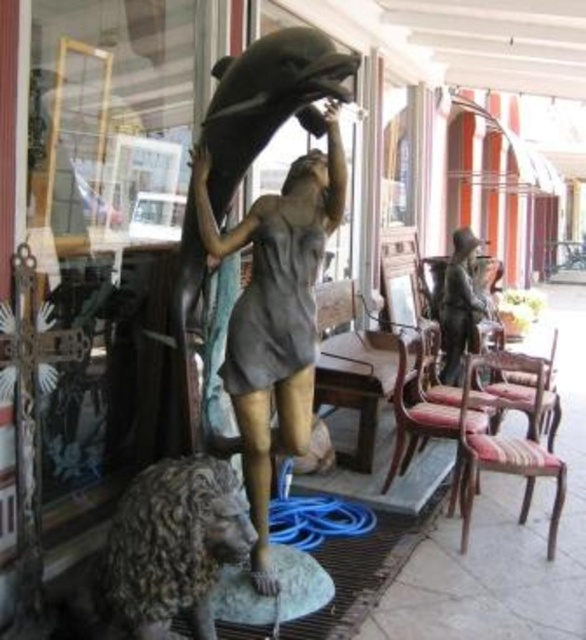
You are standing in front of the storefront display and want to sit down. The striped fabric chair at right is located at point 0.695, 0.865. Can you sit on it?

Yes, the striped fabric chair at right is located at point (x=506, y=444), so you can sit on it.

Consider the image. You are standing in front of the storefront display. Where is the bronze statue at center located in terms of coordinates?

The bronze statue at center is located at point coordinates of (275, 314).

You are a delivery person who needs to place a camera on the floor near the striped fabric chair at right. The camera must be placed exactly 4 meters away from the chair. Is the current position of the camera already correct?

The striped fabric chair at right and camera are 3.92 meters apart, so the camera is slightly closer than the required 4 meters. Move it back about 8 centimeters to meet the distance requirement.